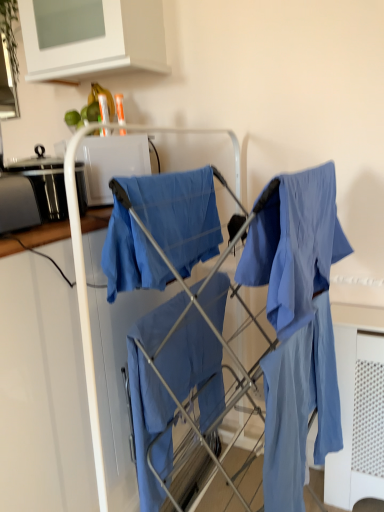
What do you see at coordinates (92, 38) in the screenshot? I see `white matte cabinet at upper center` at bounding box center [92, 38].

At what (x,y) coordinates should I click in order to perform the action: click on blue cotton cloth at center, placed as the first cloak when sorted from top to bottom. Please return your answer as a coordinate pair (x, y). This screenshot has width=384, height=512. Looking at the image, I should click on (178, 214).

In terms of width, does white glossy microwave at upper center look wider or thinner when compared to blue cotton cloth at center, placed as the first cloak when sorted from top to bottom?

white glossy microwave at upper center is wider than blue cotton cloth at center, placed as the first cloak when sorted from top to bottom.

From a real-world perspective, relative to blue cotton cloth at center, placed as the 2th cloak when sorted from bottom to top, is white glossy microwave at upper center vertically above or below?

Clearly, from a real-world perspective, white glossy microwave at upper center is above blue cotton cloth at center, placed as the 2th cloak when sorted from bottom to top.

Is white glossy microwave at upper center in front of or behind blue cotton cloth at center, placed as the first cloak when sorted from top to bottom, in the image?

Clearly, white glossy microwave at upper center is behind blue cotton cloth at center, placed as the first cloak when sorted from top to bottom.

Is white glossy microwave at upper center positioned beyond the bounds of blue cotton cloth at center, placed as the first cloak when sorted from top to bottom?

white glossy microwave at upper center is positioned outside blue cotton cloth at center, placed as the first cloak when sorted from top to bottom.

Considering the relative sizes of white matte cabinet at upper center and white glossy microwave at upper center in the image provided, is white matte cabinet at upper center shorter than white glossy microwave at upper center?

No.

Considering their positions, is white matte cabinet at upper center located in front of or behind white glossy microwave at upper center?

In the image, white matte cabinet at upper center appears in front of white glossy microwave at upper center.

Which of these two, white matte cabinet at upper center or white glossy microwave at upper center, is bigger?

white matte cabinet at upper center.

From the image's perspective, between blue cotton cloth at center, placed as the first cloak when sorted from top to bottom, and white glossy microwave at upper center, which one is located above?

white glossy microwave at upper center appears higher in the image.

The image size is (384, 512). What are the coordinates of `appliance behind the blue cotton cloth at center, placed as the first cloak when sorted from top to bottom` in the screenshot? It's located at (111, 163).

Is point (129, 271) positioned before point (96, 185)?

Yes, it is.

Between point (99, 145) and point (140, 381), which one is positioned behind?

The point (99, 145) is farther from the camera.

Who is bigger, white glossy microwave at upper center or matte blue fabric at center, which is the 2th cloak from top to bottom?

matte blue fabric at center, which is the 2th cloak from top to bottom, is bigger.

From a real-world perspective, which is physically above, white glossy microwave at upper center or matte blue fabric at center, which is the 2th cloak from top to bottom?

white glossy microwave at upper center, from a real-world perspective.

Is white glossy microwave at upper center inside or outside of matte blue fabric at center, which is the 2th cloak from top to bottom?

white glossy microwave at upper center exists outside the volume of matte blue fabric at center, which is the 2th cloak from top to bottom.

Is white matte cabinet at upper center facing away from matte blue fabric at center, which appears as the first cloak when ordered from the bottom?

white matte cabinet at upper center is not turned away from matte blue fabric at center, which appears as the first cloak when ordered from the bottom.

Between white matte cabinet at upper center and matte blue fabric at center, which appears as the first cloak when ordered from the bottom, which one has smaller width?

Thinner between the two is matte blue fabric at center, which appears as the first cloak when ordered from the bottom.

Where is `the 2nd cloak directly beneath the white matte cabinet at upper center (from a real-world perspective)`? This screenshot has height=512, width=384. the 2nd cloak directly beneath the white matte cabinet at upper center (from a real-world perspective) is located at coordinates (150, 393).

Would you say white matte cabinet at upper center is a long distance from matte blue fabric at center, which appears as the first cloak when ordered from the bottom?

Yes, white matte cabinet at upper center and matte blue fabric at center, which appears as the first cloak when ordered from the bottom, are located far from each other.

What's the angular difference between matte blue fabric at center, which is the 2th cloak from top to bottom, and white glossy microwave at upper center's facing directions?

The facing directions of matte blue fabric at center, which is the 2th cloak from top to bottom, and white glossy microwave at upper center are 132 degrees apart.

Based on the photo, from the image's perspective, is matte blue fabric at center, which is the 2th cloak from top to bottom, over white glossy microwave at upper center?

No, from the image's perspective, matte blue fabric at center, which is the 2th cloak from top to bottom, is not over white glossy microwave at upper center.

Is matte blue fabric at center, which is the 2th cloak from top to bottom, completely or partially outside of white glossy microwave at upper center?

Indeed, matte blue fabric at center, which is the 2th cloak from top to bottom, is completely outside white glossy microwave at upper center.

From a real-world perspective, is matte blue fabric at center, which appears as the first cloak when ordered from the bottom, above or below white glossy microwave at upper center?

matte blue fabric at center, which appears as the first cloak when ordered from the bottom, is situated lower than white glossy microwave at upper center in the real world.

Is matte blue fabric at center, which appears as the first cloak when ordered from the bottom, aimed at blue cotton cloth at center, placed as the 2th cloak when sorted from bottom to top?

No, matte blue fabric at center, which appears as the first cloak when ordered from the bottom, does not turn towards blue cotton cloth at center, placed as the 2th cloak when sorted from bottom to top.

Identify the location of cloak that appears above the matte blue fabric at center, which is the 2th cloak from top to bottom (from the image's perspective). The width and height of the screenshot is (384, 512). (178, 214).

Can you confirm if matte blue fabric at center, which is the 2th cloak from top to bottom, is bigger than blue cotton cloth at center, placed as the 2th cloak when sorted from bottom to top?

Yes, matte blue fabric at center, which is the 2th cloak from top to bottom, is bigger than blue cotton cloth at center, placed as the 2th cloak when sorted from bottom to top.

The image size is (384, 512). I want to click on appliance above the blue cotton cloth at center, placed as the first cloak when sorted from top to bottom (from the image's perspective), so click(x=111, y=163).

Where is `appliance below the white matte cabinet at upper center (from a real-world perspective)`? appliance below the white matte cabinet at upper center (from a real-world perspective) is located at coordinates (111, 163).

Considering their positions, is matte blue fabric at center, which appears as the first cloak when ordered from the bottom, positioned closer to white glossy microwave at upper center than white matte cabinet at upper center?

white matte cabinet at upper center is positioned closer to the anchor white glossy microwave at upper center.

Based on their spatial positions, is matte blue fabric at center, which is the 2th cloak from top to bottom, or white glossy microwave at upper center closer to blue cotton cloth at center, placed as the 2th cloak when sorted from bottom to top?

Based on the image, matte blue fabric at center, which is the 2th cloak from top to bottom, appears to be nearer to blue cotton cloth at center, placed as the 2th cloak when sorted from bottom to top.

Estimate the real-world distances between objects in this image. Which object is closer to white matte cabinet at upper center, blue cotton cloth at center, placed as the first cloak when sorted from top to bottom, or matte blue fabric at center, which is the 2th cloak from top to bottom?

Based on the image, blue cotton cloth at center, placed as the first cloak when sorted from top to bottom, appears to be nearer to white matte cabinet at upper center.

Considering their positions, is white glossy microwave at upper center positioned further to blue cotton cloth at center, placed as the 2th cloak when sorted from bottom to top, than matte blue fabric at center, which appears as the first cloak when ordered from the bottom?

white glossy microwave at upper center.

Which object lies nearer to the anchor point blue cotton cloth at center, placed as the first cloak when sorted from top to bottom, white matte cabinet at upper center or white glossy microwave at upper center?

Based on the image, white glossy microwave at upper center appears to be nearer to blue cotton cloth at center, placed as the first cloak when sorted from top to bottom.

From the image, which object appears to be nearer to white glossy microwave at upper center, matte blue fabric at center, which appears as the first cloak when ordered from the bottom, or blue cotton cloth at center, placed as the 2th cloak when sorted from bottom to top?

blue cotton cloth at center, placed as the 2th cloak when sorted from bottom to top, is positioned closer to the anchor white glossy microwave at upper center.

From the image, which object appears to be nearer to matte blue fabric at center, which is the 2th cloak from top to bottom, white glossy microwave at upper center or blue cotton cloth at center, placed as the first cloak when sorted from top to bottom?

blue cotton cloth at center, placed as the first cloak when sorted from top to bottom.

When comparing their distances from white matte cabinet at upper center, does white glossy microwave at upper center or blue cotton cloth at center, placed as the first cloak when sorted from top to bottom, seem further?

blue cotton cloth at center, placed as the first cloak when sorted from top to bottom.

The image size is (384, 512). Identify the location of cloak that lies between white matte cabinet at upper center and matte blue fabric at center, which appears as the first cloak when ordered from the bottom, from top to bottom. (178, 214).

Locate an element on the screen. Image resolution: width=384 pixels, height=512 pixels. appliance between white matte cabinet at upper center and matte blue fabric at center, which appears as the first cloak when ordered from the bottom, from top to bottom is located at coordinates (111, 163).

This screenshot has height=512, width=384. I want to click on appliance between white matte cabinet at upper center and blue cotton cloth at center, placed as the first cloak when sorted from top to bottom, in the vertical direction, so click(x=111, y=163).

At what (x,y) coordinates should I click in order to perform the action: click on cloak that lies between white glossy microwave at upper center and matte blue fabric at center, which appears as the first cloak when ordered from the bottom, from top to bottom. Please return your answer as a coordinate pair (x, y). Looking at the image, I should click on (178, 214).